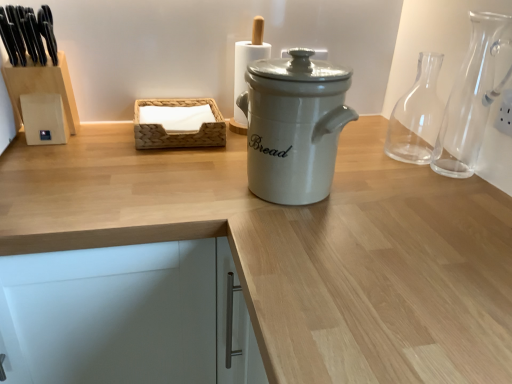
The image size is (512, 384). I want to click on free space in front of woven wood tissue box at center, so click(155, 160).